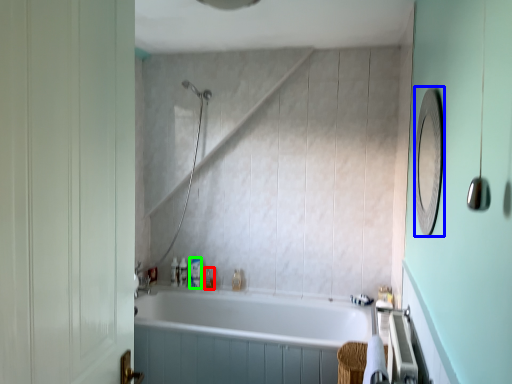
Question: Which object is the closest to the toiletry (highlighted by a red box)? Choose among these: mirror (highlighted by a blue box) or toiletry (highlighted by a green box).

Choices:
 (A) mirror
 (B) toiletry

Answer: (B)